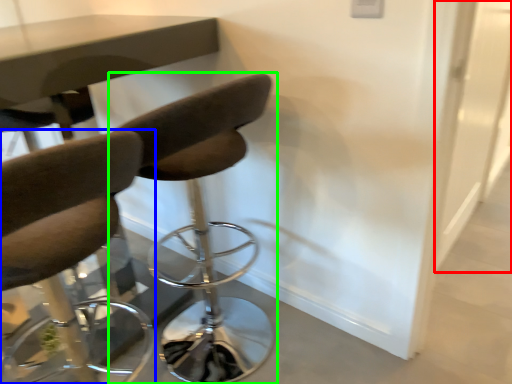
Question: Which is farther away from glass door (highlighted by a red box)? chair (highlighted by a blue box) or chair (highlighted by a green box)?

Choices:
 (A) chair
 (B) chair

Answer: (A)